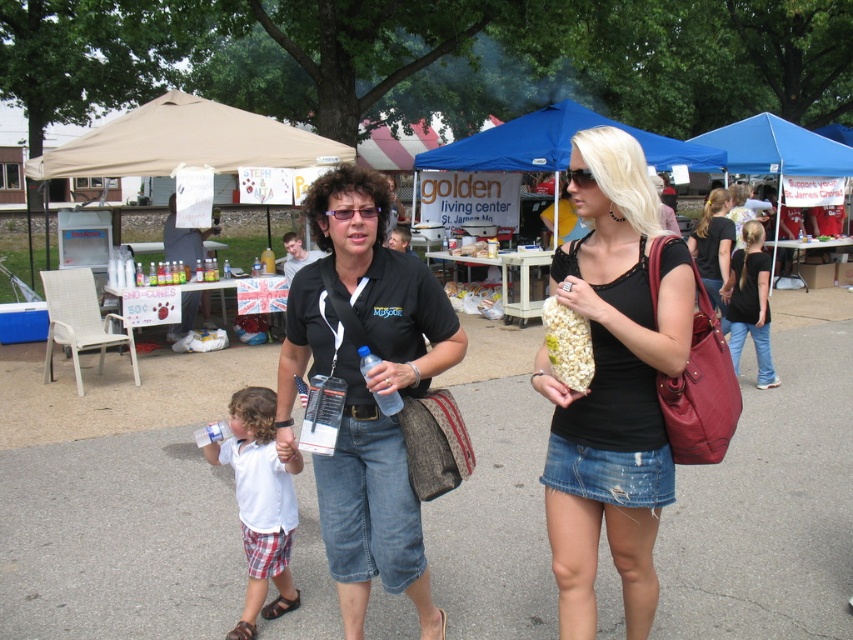
Question: Is beige fabric tent at upper left closer to camera compared to blue fabric canopy at upper right?

Choices:
 (A) no
 (B) yes

Answer: (B)

Question: Does beige fabric tent at upper left appear on the right side of black cotton shirt at right?

Choices:
 (A) no
 (B) yes

Answer: (A)

Question: Can you confirm if blue fabric canopy at upper center is positioned to the left of white popcorn at center?

Choices:
 (A) no
 (B) yes

Answer: (A)

Question: Among these objects, which one is nearest to the camera?

Choices:
 (A) black leather purse at center
 (B) white cotton shirt at center
 (C) black matte tank top at center

Answer: (C)

Question: Which point is farther to the camera?

Choices:
 (A) (741, 257)
 (B) (386, 412)
 (C) (204, 122)
 (D) (335, 216)

Answer: (C)

Question: Which point appears closest to the camera in this image?

Choices:
 (A) (724, 256)
 (B) (247, 492)
 (C) (589, 364)

Answer: (C)